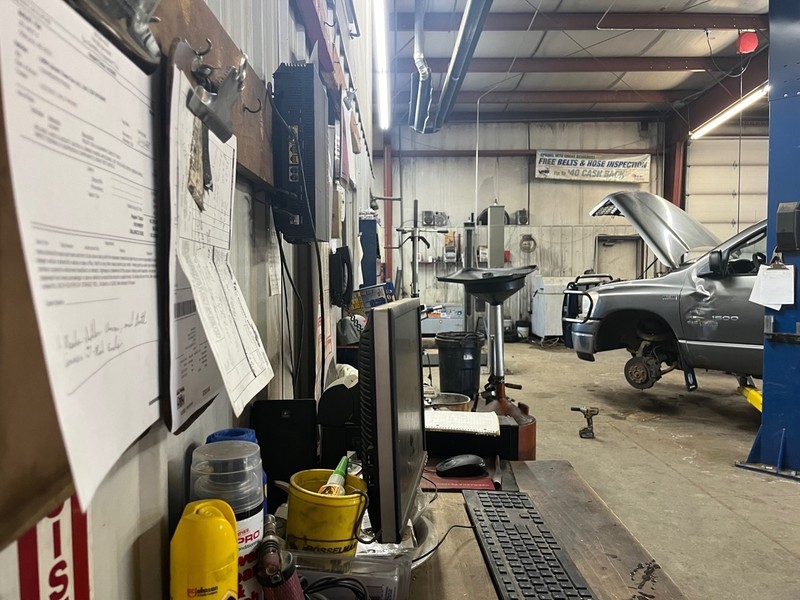
You are a GUI agent. You are given a task and a screenshot of the screen. Output one action in this format:
    pyautogui.click(x=<x>, y=<y>)
    Task: Click on the blue pillar
    This screenshot has width=800, height=600.
    Given the screenshot: What is the action you would take?
    794,121